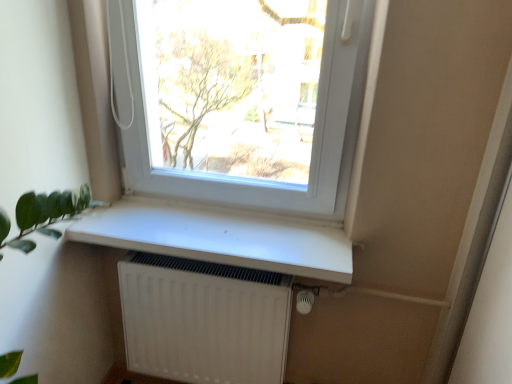
Question: Based on their sizes in the image, would you say white plastic window at upper center is bigger or smaller than white matte window sill at center?

Choices:
 (A) small
 (B) big

Answer: (B)

Question: Considering the positions of point (296, 211) and point (230, 221), is point (296, 211) closer or farther from the camera than point (230, 221)?

Choices:
 (A) farther
 (B) closer

Answer: (B)

Question: Considering the real-world distances, which object is farthest from the white matte radiator at lower center?

Choices:
 (A) white matte window sill at center
 (B) white plastic window at upper center

Answer: (B)

Question: Estimate the real-world distances between objects in this image. Which object is farther from the white matte radiator at lower center?

Choices:
 (A) white matte window sill at center
 (B) white plastic window at upper center

Answer: (B)